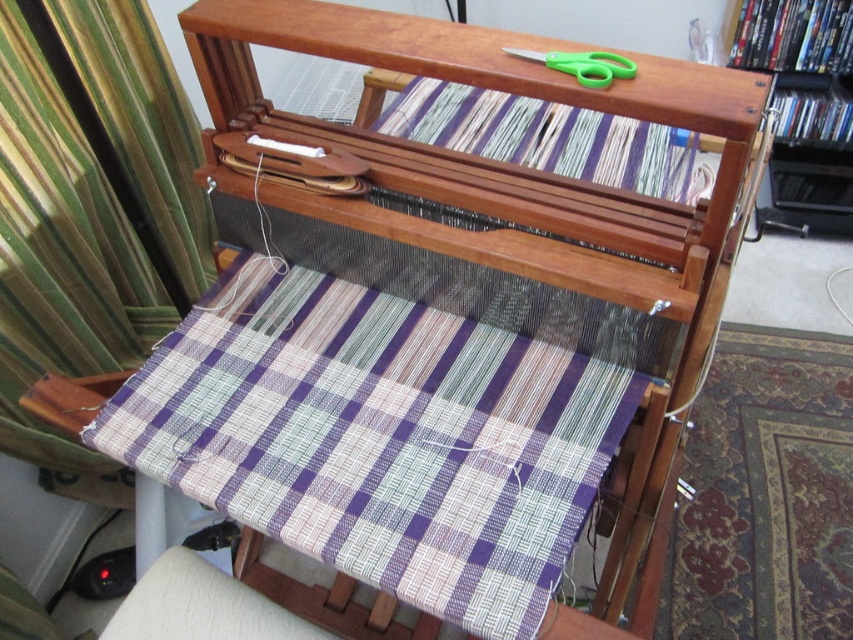
You are a weaver who needs to cut the current thread. The purple woven fabric at center is where you are working, and the green plastic scissors at upper center are nearby. Can you reach the scissors without moving your hands from the fabric?

The distance between the purple woven fabric at center and the green plastic scissors at upper center is 19.32 inches. Since this distance is relatively short, you can likely reach the scissors without needing to move your hands away from the fabric.

You are an artisan working on a weaving project. You need to access both the purple woven fabric at center and the plaid fabric at upper center. Which fabric is positioned lower in the loom?

The purple woven fabric at center is below plaid fabric at upper center, so the purple woven fabric at center is positioned lower in the loom.

You are a weaver standing in front of the loom. You need to place a new thread exactly at the center of the purple woven fabric at center. According to the coordinates provided, where should you place the thread?

The purple woven fabric at center is located at point (379, 436), so you should place the new thread at those coordinates to ensure it is centered.